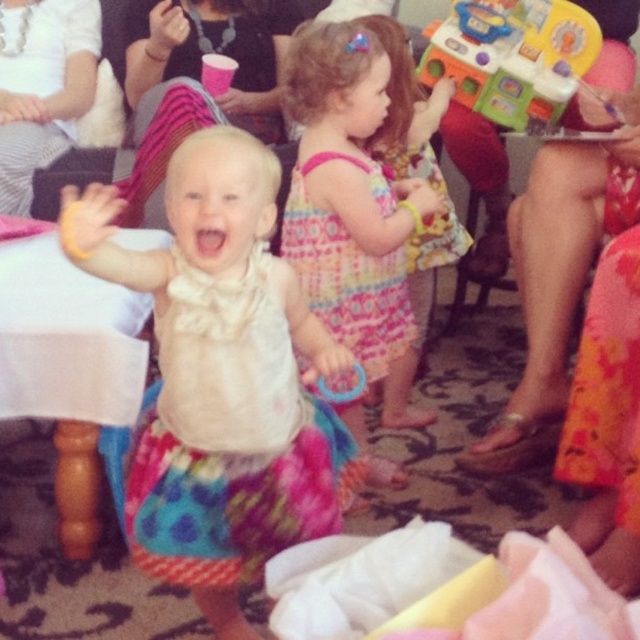
Question: Does metallic silver flip-flop at lower right come behind multicolored plastic toy at upper right?

Choices:
 (A) no
 (B) yes

Answer: (A)

Question: Is matte white dress at center to the left of printed cotton dress at center from the viewer's perspective?

Choices:
 (A) yes
 (B) no

Answer: (A)

Question: Which point is closer to the camera?

Choices:
 (A) pastel floral dress at center
 (B) multicolored plastic toy at upper right
 (C) printed cotton dress at center
 (D) metallic silver flip-flop at lower right

Answer: (C)

Question: Which point is closer to the camera?

Choices:
 (A) (497, 116)
 (B) (376, 268)
 (C) (296, 420)

Answer: (C)

Question: Which point is closer to the camera?

Choices:
 (A) (228, 368)
 (B) (580, 36)
 (C) (403, 326)
 (D) (310, 294)

Answer: (A)

Question: Is multicolored plastic toy at upper right above printed cotton dress at center?

Choices:
 (A) no
 (B) yes

Answer: (B)